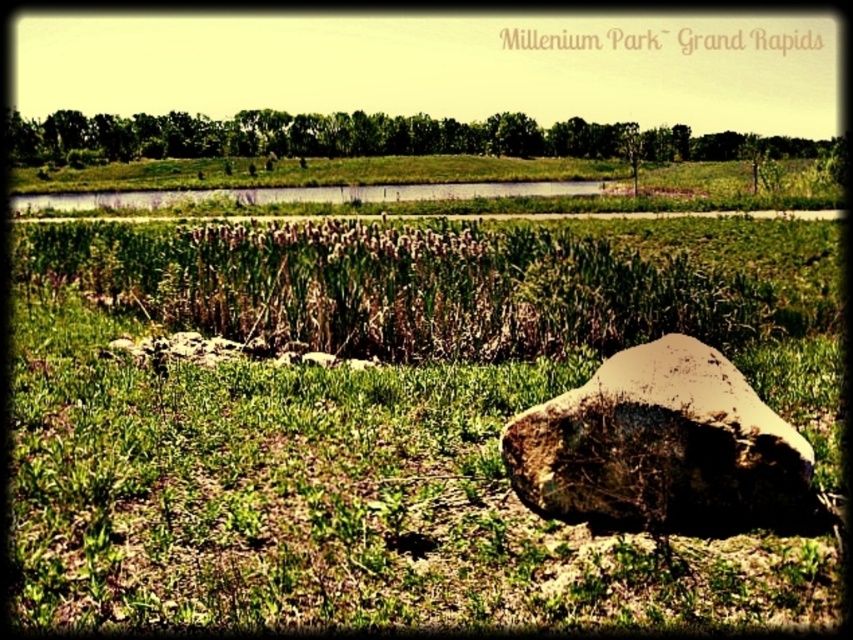
You are standing at the point with coordinates point (630, 362) in the scene. You want to walk to the point with coordinates point (56, 275). Which direction should you move relative to your current position?

You should move towards the lower left direction because point (56, 275) is behind point (630, 362), meaning it is located in the lower left direction from your current position.

You are standing at the edge of the grassy area in Millenium Park, Grand Rapids. You see the green grassy at center. Can you walk directly towards it without stepping on any rocks or reeds?

Yes, you can walk directly towards the green grassy at center because it is located at point (366, 428), which is in the center area away from the rocks and reeds.